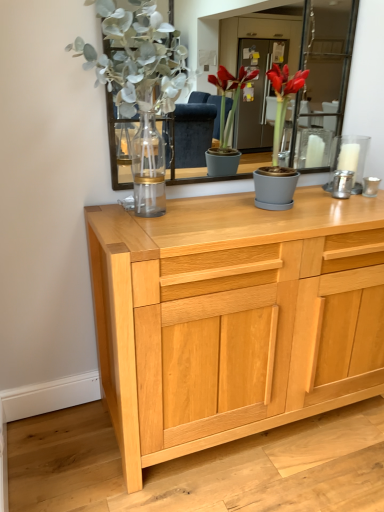
The height and width of the screenshot is (512, 384). What are the coordinates of `free space on the front side of matte gray pot at center` in the screenshot? It's located at (282, 220).